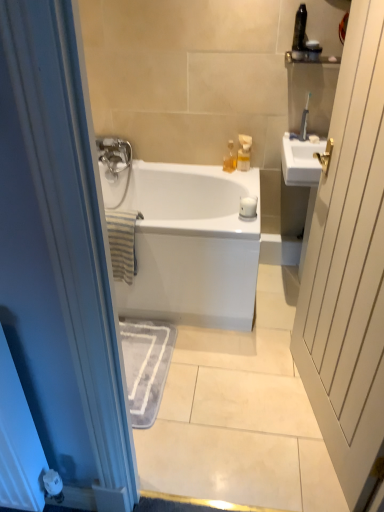
Where is `free space to the left of translucent plastic bottle at upper center, which is the 1th toiletry in left-to-right order`? free space to the left of translucent plastic bottle at upper center, which is the 1th toiletry in left-to-right order is located at coordinates (212, 168).